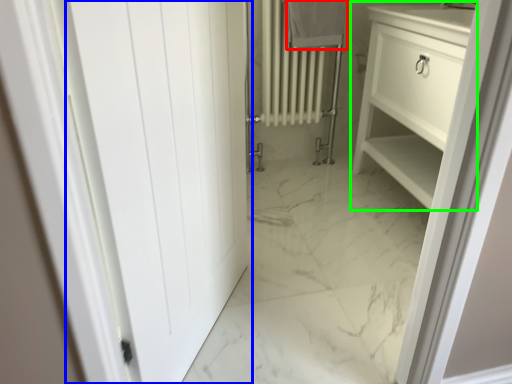
Question: Which object is the farthest from bath towel (highlighted by a red box)? Choose among these: door (highlighted by a blue box) or bathroom cabinet (highlighted by a green box).

Choices:
 (A) door
 (B) bathroom cabinet

Answer: (A)